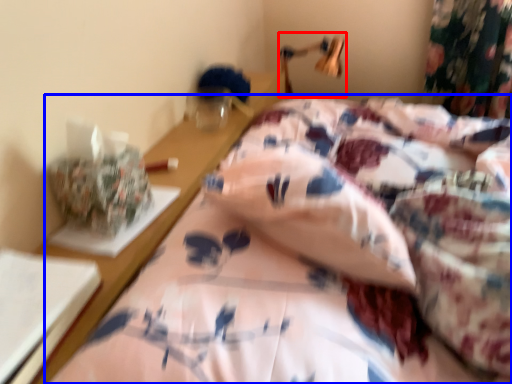
Question: Among these objects, which one is nearest to the camera, table lamp (highlighted by a red box) or bed (highlighted by a blue box)?

Choices:
 (A) table lamp
 (B) bed

Answer: (B)